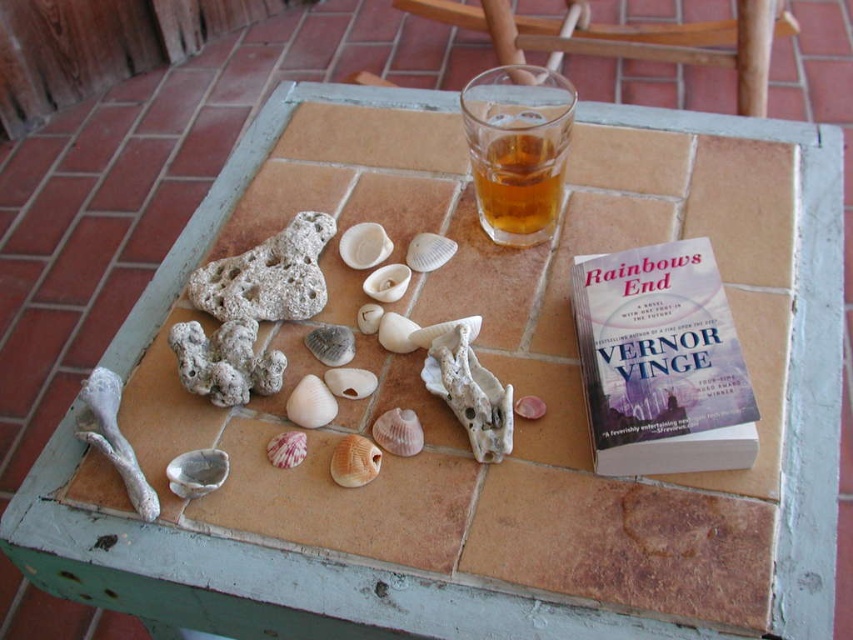
You are setting up a small outdoor display on the table. You have two items to place next to each other. The matte purple cover at upper right and the translucent glass at upper center. Which item should you place higher to ensure stability?

The matte purple cover at upper right is much taller than the translucent glass at upper center, so placing it higher would provide better stability.

You are sitting at the table and want to pick up the matte purple cover at upper right and the smooth beige shell at center. Which object will you need to reach further for?

The smooth beige shell at center requires reaching further because it is farther from the viewer compared to the matte purple cover at upper right.

You are standing 10 inches away from the table. If you want to reach the point at coordinates point (664, 387), how much farther do you need to move forward?

The point at coordinates point (664, 387) is 13.27 inches away from the viewer. Since you are currently 10 inches away from the table, you need to move forward an additional 3.27 inches to reach it.